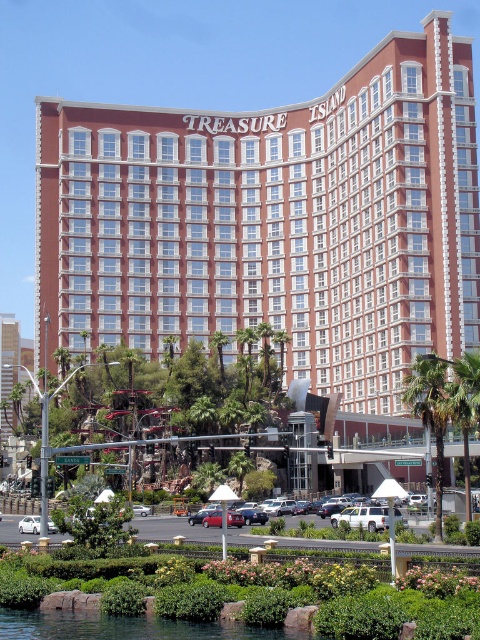
Question: Does green leafy water at lower center have a lesser width compared to green leafy palm tree at lower right?

Choices:
 (A) yes
 (B) no

Answer: (B)

Question: Which point is farther from the camera taking this photo?

Choices:
 (A) (471, 388)
 (B) (156, 627)
 (C) (24, 528)
 (D) (418, 355)

Answer: (D)

Question: Which of the following is the farthest from the observer?

Choices:
 (A) (351, 209)
 (B) (121, 630)
 (C) (468, 364)

Answer: (A)

Question: Is red brick hotel at center smaller than green leafy palm tree at lower right?

Choices:
 (A) no
 (B) yes

Answer: (A)

Question: Does green leafy water at lower center appear on the left side of green leafy palm tree at lower right?

Choices:
 (A) no
 (B) yes

Answer: (B)

Question: Among these points, which one is farthest from the camera?

Choices:
 (A) (24, 609)
 (B) (85, 330)

Answer: (B)